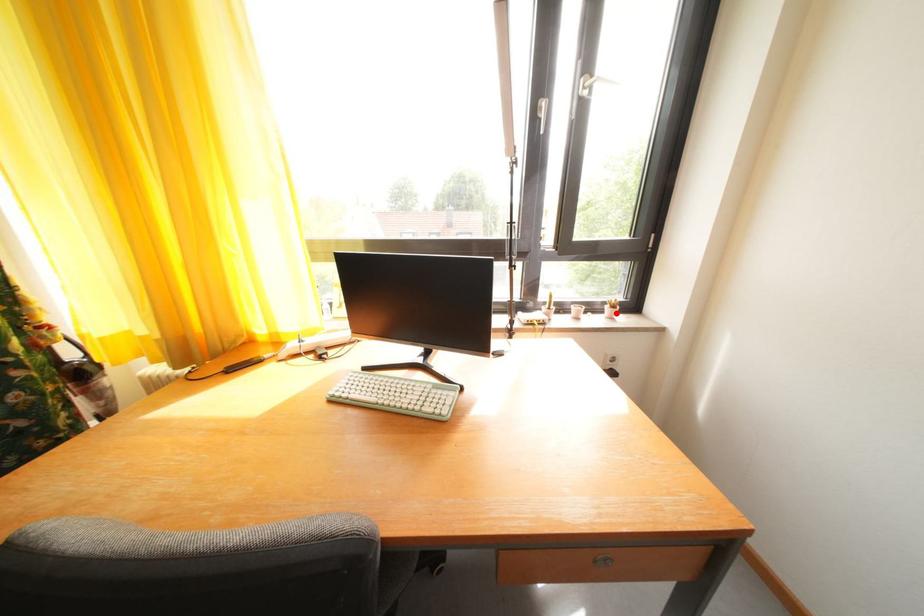
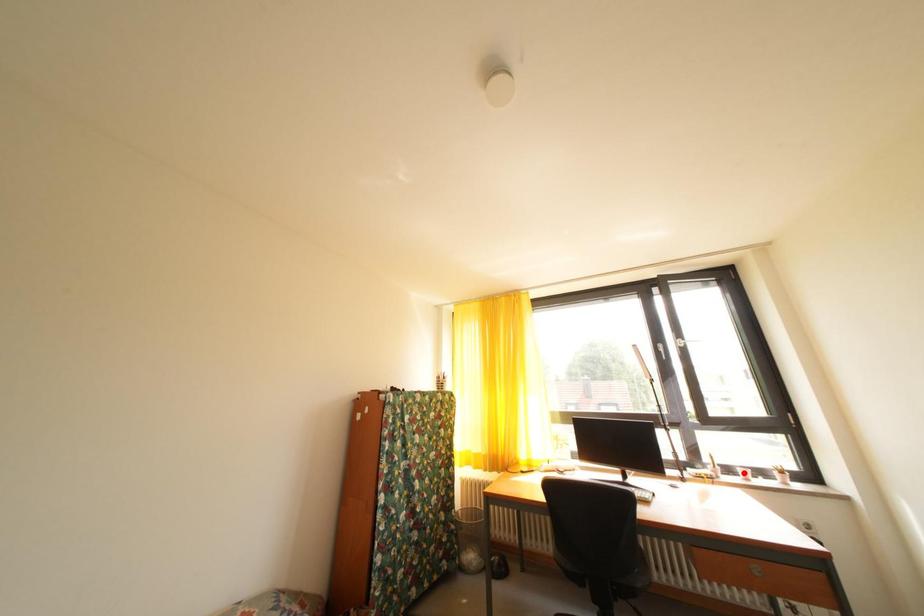
I am providing you with two images of the same scene from different viewpoints. A red point is marked on the first image and another point is marked on the second image. Do the highlighted points in image1 and image2 indicate the same real-world spot?

No